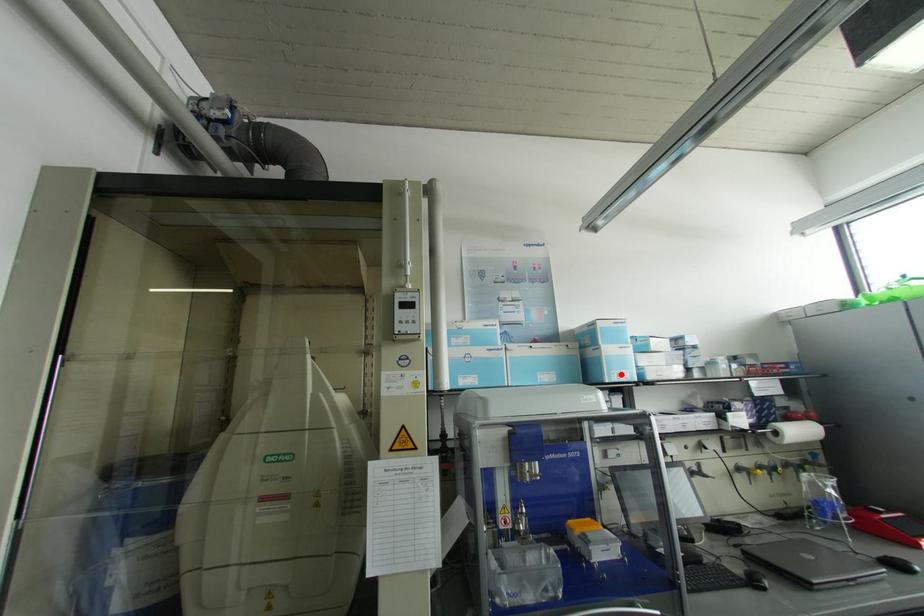
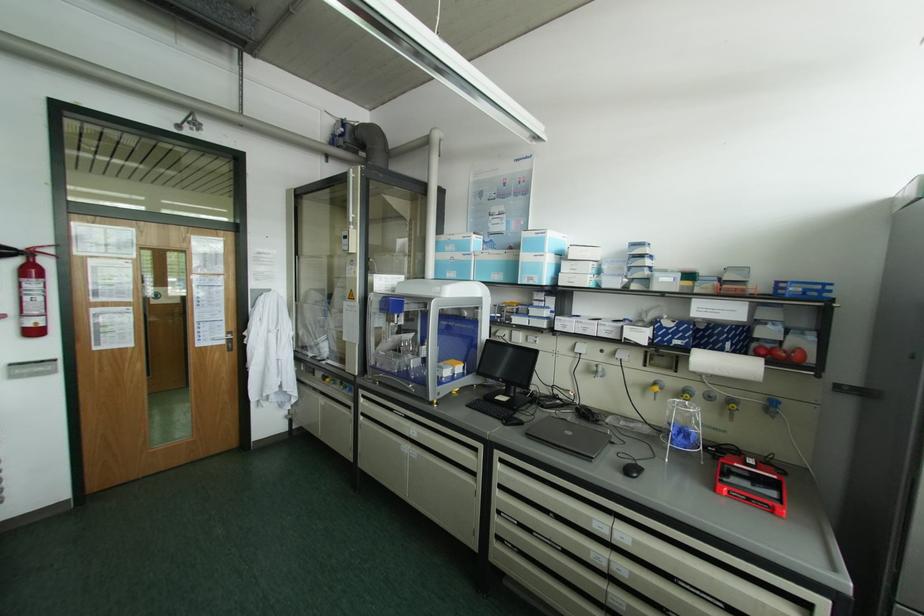
Locate, in the second image, the point that corresponds to the highlighted location in the first image.

(530, 278)